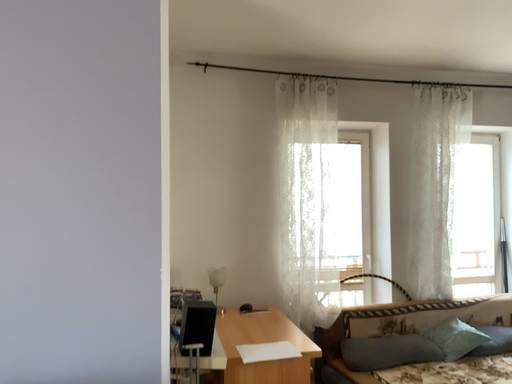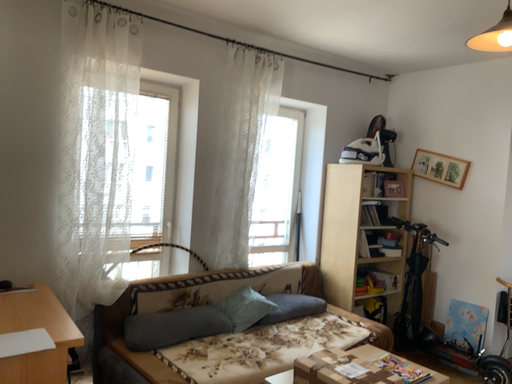
Question: How did the camera likely rotate when shooting the video?

Choices:
 (A) rotated right
 (B) rotated left

Answer: (A)